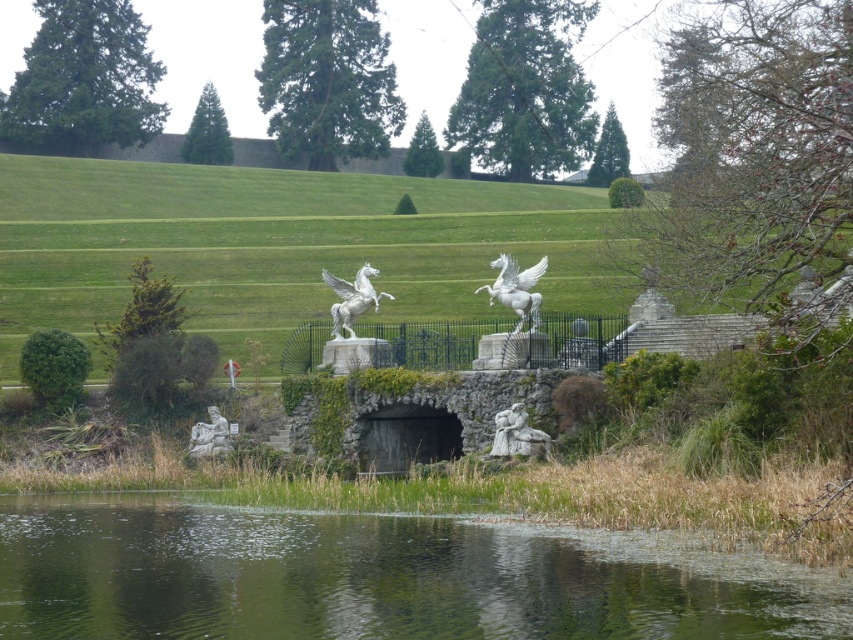
Question: Is white marble horse at center to the left of carved stone figure at center from the viewer's perspective?

Choices:
 (A) yes
 (B) no

Answer: (A)

Question: Which point is farther to the camera?

Choices:
 (A) white stone statue at lower left
 (B) carved stone figure at center

Answer: (A)

Question: Which point is closer to the camera taking this photo?

Choices:
 (A) (347, 588)
 (B) (358, 285)
 (C) (219, 452)
 (D) (482, 260)

Answer: (A)

Question: Can you confirm if green reflective water at lower center is positioned to the right of white marble horse at center?

Choices:
 (A) no
 (B) yes

Answer: (A)

Question: Based on their relative distances, which object is nearer to the white marble winged horse at center?

Choices:
 (A) carved stone figure at center
 (B) white stone hillside at center
 (C) green reflective water at lower center

Answer: (A)

Question: Can you confirm if green reflective water at lower center is positioned to the left of white marble horse at center?

Choices:
 (A) no
 (B) yes

Answer: (B)